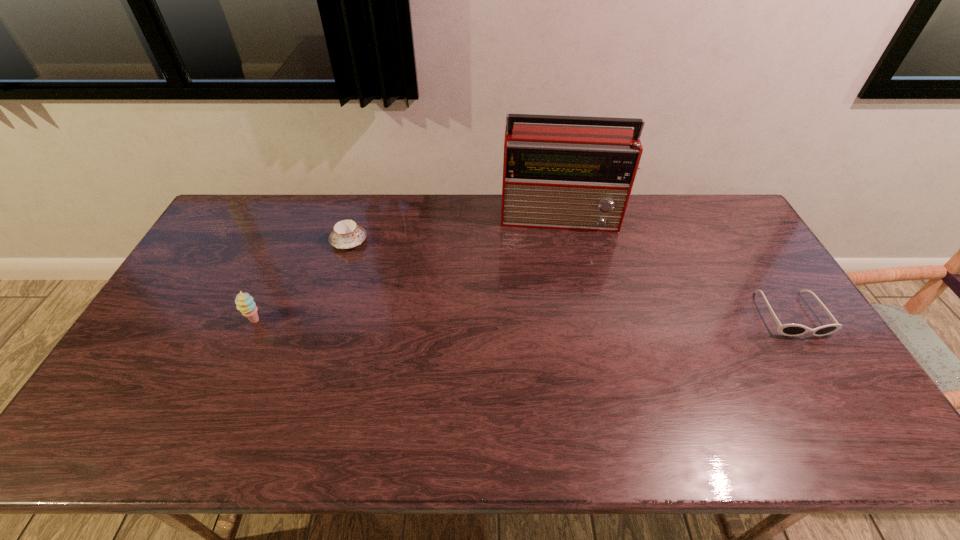
Image resolution: width=960 pixels, height=540 pixels. I want to click on free space at the near edge, so click(x=310, y=408).

This screenshot has height=540, width=960. In order to click on vacant space at the left edge of the desktop in this screenshot , I will do `click(192, 337)`.

The height and width of the screenshot is (540, 960). In the image, there is a desktop. What are the coordinates of `free space at the right edge` in the screenshot? It's located at (761, 347).

The height and width of the screenshot is (540, 960). I want to click on free region at the far left corner, so click(273, 204).

Find the location of `vacant area between the third tallest object and the leftmost object`. vacant area between the third tallest object and the leftmost object is located at coordinates (302, 281).

Locate an element on the screen. vacant area that lies between the leftmost object and the third tallest object is located at coordinates (302, 281).

This screenshot has width=960, height=540. What are the coordinates of `vacant point located between the third object from right to left and the third shortest object` in the screenshot? It's located at (302, 281).

Find the location of `vacant area that lies between the rightmost object and the teacup`. vacant area that lies between the rightmost object and the teacup is located at coordinates (570, 278).

Locate an element on the screen. free spot between the rightmost object and the third object from left to right is located at coordinates (676, 266).

This screenshot has width=960, height=540. I want to click on free space between the second tallest object and the second shortest object, so click(302, 281).